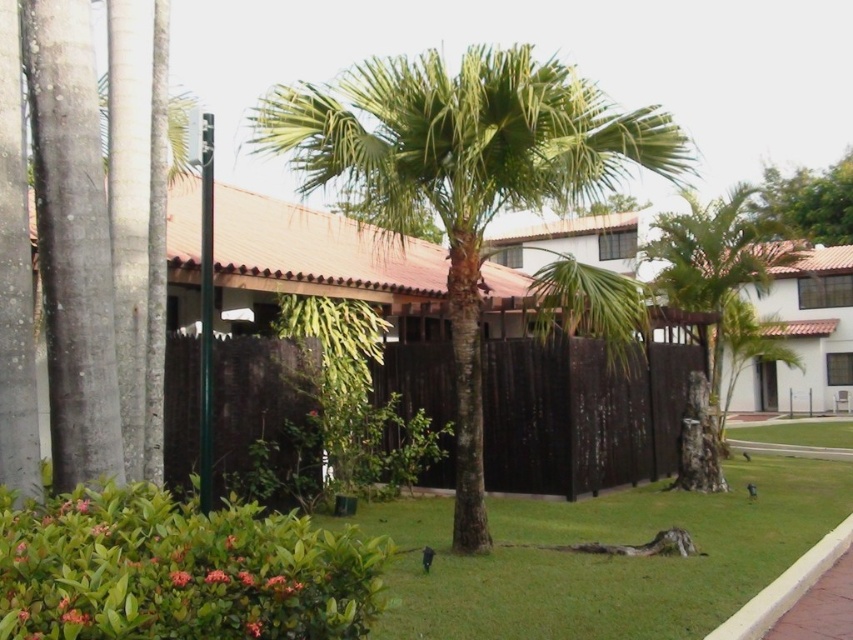
Between point (596, 509) and point (845, 212), which one is positioned behind?

Point (845, 212)

Who is more forward, (496, 541) or (838, 209)?

Point (496, 541)

The height and width of the screenshot is (640, 853). I want to click on green grass at center, so click(x=604, y=556).

Which is behind, point (647, 157) or point (474, 570)?

The point (647, 157) is behind.

Between green leafy palm tree at center and green grass at center, which one has less height?

green grass at center

From the picture: Who is more forward, (410,164) or (583,588)?

Point (583,588) is more forward.

At what (x,y) coordinates should I click in order to perform the action: click on green leafy palm tree at center. Please return your answer as a coordinate pair (x, y). The height and width of the screenshot is (640, 853). Looking at the image, I should click on (463, 177).

Looking at this image, who is positioned more to the right, brown wood fence at center or green leafy tree at upper right?

green leafy tree at upper right is more to the right.

Between brown wood fence at center and green leafy tree at upper right, which one has less height?

Standing shorter between the two is brown wood fence at center.

Is point (257, 385) positioned after point (788, 232)?

No, (257, 385) is closer to viewer.

What are the coordinates of `brown wood fence at center` in the screenshot? It's located at (579, 413).